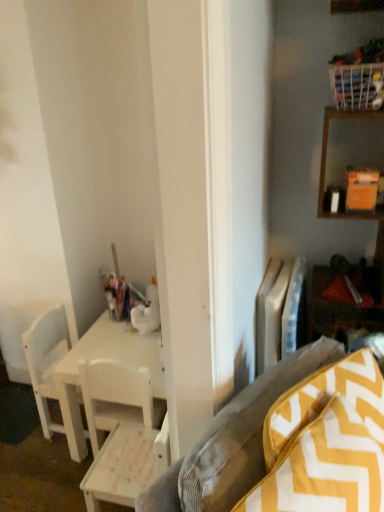
In order to face white plastic radiator at center right, should I rotate leftwards or rightwards?

Turn right by 11.750 degrees to look at white plastic radiator at center right.

This screenshot has width=384, height=512. I want to click on white wood chair at lower left, which is counted as the 1th chair, starting from the right, so click(x=121, y=433).

Considering the sizes of white matte chair at left, the second chair when ordered from right to left, and white plastic radiator at center right in the image, is white matte chair at left, the second chair when ordered from right to left, taller or shorter than white plastic radiator at center right?

white matte chair at left, the second chair when ordered from right to left, is taller than white plastic radiator at center right.

Who is smaller, white matte chair at left, the second chair positioned from the front, or white plastic radiator at center right?

white plastic radiator at center right.

Is point (51, 435) behind point (287, 260)?

Yes, it is.

Consider the image. Choose the correct answer: Is white matte chair at left, which is the first chair in back-to-front order, inside white plastic radiator at center right or outside it?

white matte chair at left, which is the first chair in back-to-front order, is spatially situated outside white plastic radiator at center right.

Who is shorter, white matte chair at left, acting as the first chair starting from the left, or white wood chair at lower left, which is counted as the 1th chair, starting from the right?

Standing shorter between the two is white wood chair at lower left, which is counted as the 1th chair, starting from the right.

From the image's perspective, is white matte chair at left, the second chair when ordered from right to left, on white wood chair at lower left, which is counted as the 1th chair, starting from the right?

Yes, from the image's perspective, white matte chair at left, the second chair when ordered from right to left, is over white wood chair at lower left, which is counted as the 1th chair, starting from the right.

Which object is more forward, white matte chair at left, which is the first chair in back-to-front order, or white wood chair at lower left, which ranks as the 2th chair in left-to-right order?

white wood chair at lower left, which ranks as the 2th chair in left-to-right order, is closer to the camera.

Is white matte chair at left, the second chair when ordered from right to left, aimed at white wood chair at lower left, which is counted as the 1th chair, starting from the right?

No, white matte chair at left, the second chair when ordered from right to left, is not turned towards white wood chair at lower left, which is counted as the 1th chair, starting from the right.

Is white wood desk at center bigger or smaller than white matte chair at left, the second chair when ordered from right to left?

Considering their sizes, white wood desk at center takes up less space than white matte chair at left, the second chair when ordered from right to left.

From a real-world perspective, is white wood desk at center positioned over white matte chair at left, the second chair when ordered from right to left, based on gravity?

No.

Is white wood desk at center at the left side of white matte chair at left, which is the first chair in back-to-front order?

No, white wood desk at center is not to the left of white matte chair at left, which is the first chair in back-to-front order.

Who is more distant, white wood desk at center or white matte chair at left, which is the first chair in back-to-front order?

white matte chair at left, which is the first chair in back-to-front order.

Considering the sizes of yellow zigzag-patterned cushion at lower right and white plastic radiator at center right in the image, is yellow zigzag-patterned cushion at lower right wider or thinner than white plastic radiator at center right?

yellow zigzag-patterned cushion at lower right is wider than white plastic radiator at center right.

From a real-world perspective, who is located higher, yellow zigzag-patterned cushion at lower right or white plastic radiator at center right?

From a 3D spatial view, yellow zigzag-patterned cushion at lower right is above.

From the image's perspective, between yellow zigzag-patterned cushion at lower right and white plastic radiator at center right, who is located below?

From the image's view, yellow zigzag-patterned cushion at lower right is below.

How different are the orientations of yellow zigzag-patterned cushion at lower right and white plastic radiator at center right in degrees?

The angular difference between yellow zigzag-patterned cushion at lower right and white plastic radiator at center right is 25.2 degrees.

In terms of size, does white wood chair at lower left, which ranks as the 2th chair in left-to-right order, appear bigger or smaller than white matte chair at left, acting as the first chair starting from the left?

In the image, white wood chair at lower left, which ranks as the 2th chair in left-to-right order, appears to be larger than white matte chair at left, acting as the first chair starting from the left.

Does white wood chair at lower left, which ranks as the 2th chair in left-to-right order, lie behind white matte chair at left, acting as the first chair starting from the left?

No, white wood chair at lower left, which ranks as the 2th chair in left-to-right order, is in front of white matte chair at left, acting as the first chair starting from the left.

Can you confirm if white wood chair at lower left, which is counted as the 1th chair, starting from the right, is positioned to the right of white matte chair at left, the second chair positioned from the front?

Correct, you'll find white wood chair at lower left, which is counted as the 1th chair, starting from the right, to the right of white matte chair at left, the second chair positioned from the front.

Does white wood chair at lower left, which is counted as the 1th chair, starting from the right, turn towards white matte chair at left, the second chair when ordered from right to left?

No.

From a real-world perspective, who is located higher, white plastic radiator at center right or yellow zigzag-patterned cushion at lower right?

yellow zigzag-patterned cushion at lower right.

Is white plastic radiator at center right positioned before yellow zigzag-patterned cushion at lower right?

No, white plastic radiator at center right is behind yellow zigzag-patterned cushion at lower right.

Can you confirm if white plastic radiator at center right is shorter than yellow zigzag-patterned cushion at lower right?

Yes.

At what (x,y) coordinates should I click in order to perform the action: click on radiator behind the yellow zigzag-patterned cushion at lower right. Please return your answer as a coordinate pair (x, y). This screenshot has height=512, width=384. Looking at the image, I should click on (280, 312).

Is point (96, 431) closer or farther from the camera than point (166, 475)?

Point (96, 431) appears to be farther away from the viewer than point (166, 475).

Is white wood chair at lower left, which is counted as the 1th chair, starting from the right, to the left or to the right of yellow zigzag-patterned cushion at lower right in the image?

From the image, it's evident that white wood chair at lower left, which is counted as the 1th chair, starting from the right, is to the left of yellow zigzag-patterned cushion at lower right.

Is white wood chair at lower left, acting as the 1th chair starting from the front, shorter than yellow zigzag-patterned cushion at lower right?

Yes, white wood chair at lower left, acting as the 1th chair starting from the front, is shorter than yellow zigzag-patterned cushion at lower right.

Where is `radiator that is above the white matte chair at left, the second chair when ordered from right to left (from a real-world perspective)`? radiator that is above the white matte chair at left, the second chair when ordered from right to left (from a real-world perspective) is located at coordinates (280, 312).

Image resolution: width=384 pixels, height=512 pixels. Find the location of `chair to the left of white wood chair at lower left, which ranks as the 2th chair in left-to-right order`. chair to the left of white wood chair at lower left, which ranks as the 2th chair in left-to-right order is located at coordinates (x=46, y=362).

Based on their spatial positions, is yellow zigzag-patterned cushion at lower right or white wood desk at center closer to white wood chair at lower left, which is counted as the 1th chair, starting from the right?

white wood desk at center.

Looking at this image, when comparing their distances from yellow zigzag-patterned cushion at lower right, does white wood chair at lower left, acting as the 1th chair starting from the front, or white plastic radiator at center right seem further?

white plastic radiator at center right is positioned further to the anchor yellow zigzag-patterned cushion at lower right.

Based on their spatial positions, is white wood desk at center or white wood chair at lower left, which ranks as the 2th chair in left-to-right order, closer to white matte chair at left, which is the first chair in back-to-front order?

Based on the image, white wood desk at center appears to be nearer to white matte chair at left, which is the first chair in back-to-front order.

Estimate the real-world distances between objects in this image. Which object is further from white wood chair at lower left, the 2th chair in the back-to-front sequence, yellow zigzag-patterned cushion at lower right or white plastic radiator at center right?

white plastic radiator at center right is further to white wood chair at lower left, the 2th chair in the back-to-front sequence.

Looking at this image, from the image, which object appears to be farther from white wood desk at center, yellow zigzag-patterned cushion at lower right or white matte chair at left, the second chair positioned from the front?

yellow zigzag-patterned cushion at lower right is further to white wood desk at center.

Based on their spatial positions, is white matte chair at left, which is the first chair in back-to-front order, or white wood chair at lower left, the 2th chair in the back-to-front sequence, closer to white wood desk at center?

Based on the image, white wood chair at lower left, the 2th chair in the back-to-front sequence, appears to be nearer to white wood desk at center.

Considering their positions, is white wood chair at lower left, acting as the 1th chair starting from the front, positioned closer to white matte chair at left, which is the first chair in back-to-front order, than white plastic radiator at center right?

Among the two, white wood chair at lower left, acting as the 1th chair starting from the front, is located nearer to white matte chair at left, which is the first chair in back-to-front order.

Which object lies further to the anchor point white plastic radiator at center right, white matte chair at left, acting as the first chair starting from the left, or yellow zigzag-patterned cushion at lower right?

The object further to white plastic radiator at center right is white matte chair at left, acting as the first chair starting from the left.

Where is `desk positioned between white wood chair at lower left, the 2th chair in the back-to-front sequence, and white matte chair at left, which is the first chair in back-to-front order, from near to far`? The width and height of the screenshot is (384, 512). desk positioned between white wood chair at lower left, the 2th chair in the back-to-front sequence, and white matte chair at left, which is the first chair in back-to-front order, from near to far is located at coordinates (103, 358).

Where is `desk located between white matte chair at left, the second chair positioned from the front, and white plastic radiator at center right in the left-right direction`? The image size is (384, 512). desk located between white matte chair at left, the second chair positioned from the front, and white plastic radiator at center right in the left-right direction is located at coordinates (103, 358).

You are a GUI agent. You are given a task and a screenshot of the screen. Output one action in this format:
    pyautogui.click(x=<x>, y=<y>)
    Task: Click on the radiator located between yellow zigzag-patterned cushion at lower right and white matte chair at left, acting as the first chair starting from the left, in the depth direction
    This screenshot has height=512, width=384.
    Given the screenshot: What is the action you would take?
    pyautogui.click(x=280, y=312)

Image resolution: width=384 pixels, height=512 pixels. I want to click on desk between yellow zigzag-patterned cushion at lower right and white matte chair at left, the second chair when ordered from right to left, along the z-axis, so click(x=103, y=358).